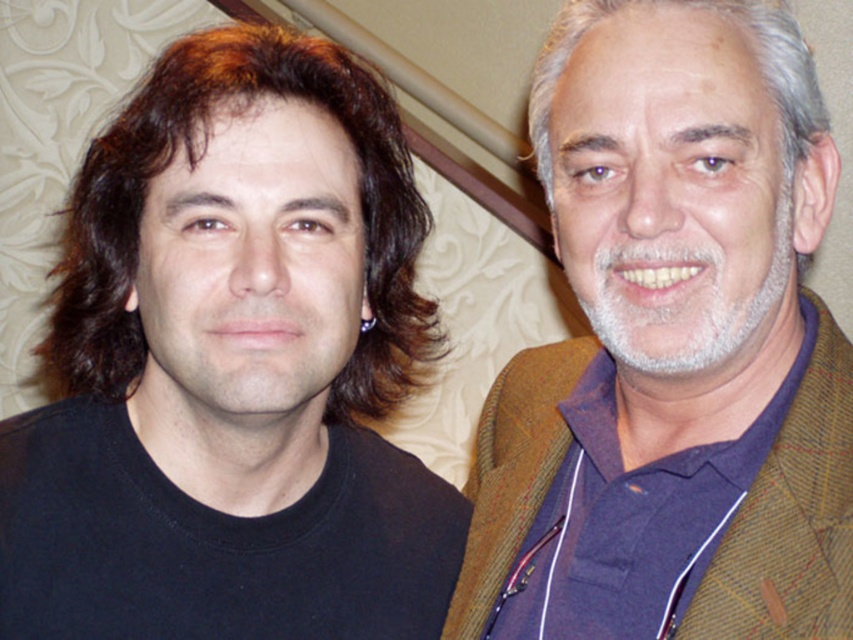
Who is positioned more to the left, brown woolen jacket at right or brownshinyhair at left?

From the viewer's perspective, brownshinyhair at left appears more on the left side.

In the scene shown: How distant is brown woolen jacket at right from brownshinyhair at left?

brown woolen jacket at right and brownshinyhair at left are 24.84 centimeters apart from each other.

This screenshot has width=853, height=640. I want to click on brown woolen jacket at right, so click(x=672, y=348).

Find the location of a particular element. The image size is (853, 640). brown woolen jacket at right is located at coordinates (672, 348).